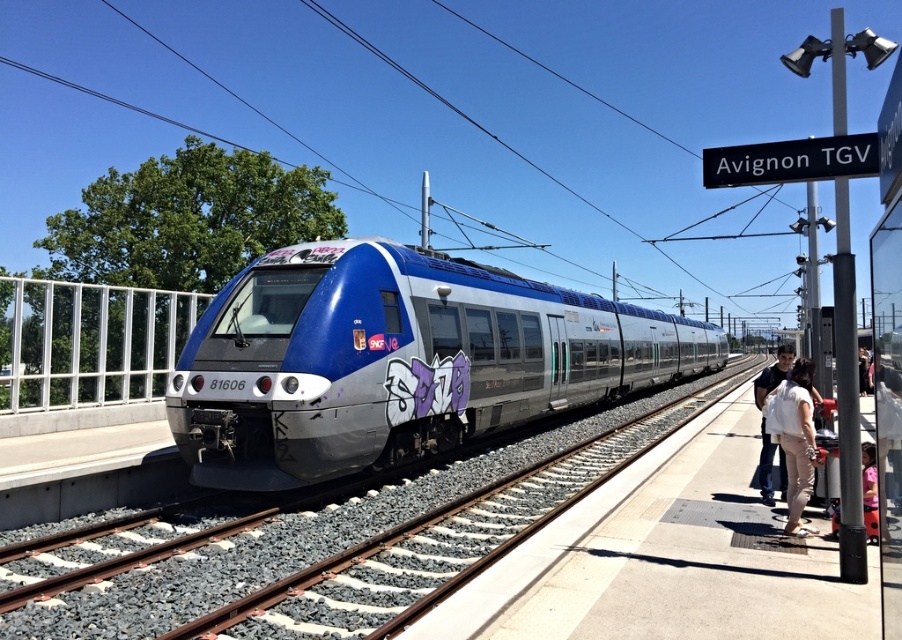
Question: Which point is farther to the camera?

Choices:
 (A) pink fabric at lower right
 (B) metallic train tracks at center
 (C) metallic silver train at center
 (D) light beige pants at right

Answer: (C)

Question: Is metallic silver train at right to the left of pink fabric at lower right from the viewer's perspective?

Choices:
 (A) yes
 (B) no

Answer: (B)

Question: Can you confirm if metallic silver train at center is bigger than pink fabric at lower right?

Choices:
 (A) yes
 (B) no

Answer: (A)

Question: Can you confirm if metallic silver train at center is bigger than pink fabric at lower right?

Choices:
 (A) no
 (B) yes

Answer: (B)

Question: Estimate the real-world distances between objects in this image. Which object is farther from the metallic silver train at center?

Choices:
 (A) metallic silver train at right
 (B) light beige pants at right
 (C) pink fabric at lower right

Answer: (B)

Question: Considering the real-world distances, which object is closest to the metallic train tracks at center?

Choices:
 (A) metallic silver train at right
 (B) metallic silver train at center
 (C) pink fabric at lower right
 (D) light beige pants at right

Answer: (B)